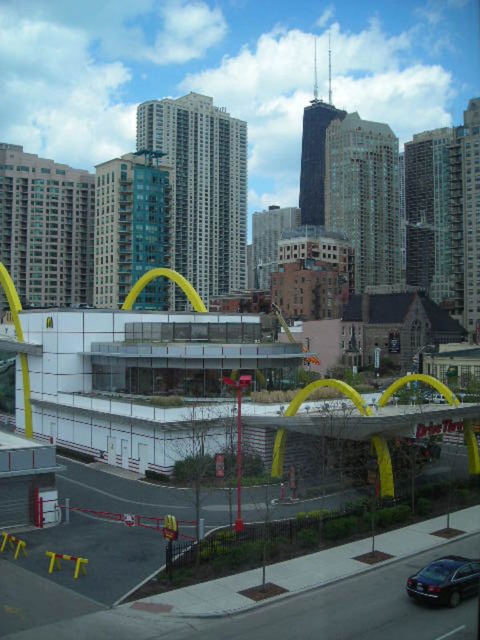
You are a delivery driver who needs to park your vehicle, which is 1.8 meters wide, in the parking lot near the McDonalds restaurant. The parking space has a shiny black sedan at lower right and a yellow rubber at center. Can your vehicle fit between them?

The shiny black sedan at lower right is thinner than yellow rubber at center. Since the width between them is determined by the thinner object, your vehicle which is 1.8 meters wide can fit between them if the space between the shiny black sedan at lower right and yellow rubber at center is at least 1.8 meters. However, without knowing the exact distance, it is uncertain. Please check the actual space before parking.

In the scene shown: You are a delivery driver needing to park your 5.5 meter long vehicle. You see the shiny black sedan at lower right and the yellow rubber at center. Can you park your vehicle between them without overlapping either object?

The distance between the shiny black sedan at lower right and the yellow rubber at center is 75.41 meters. Since your vehicle is only 5.5 meters long, there is sufficient space to park between them without overlapping either object.